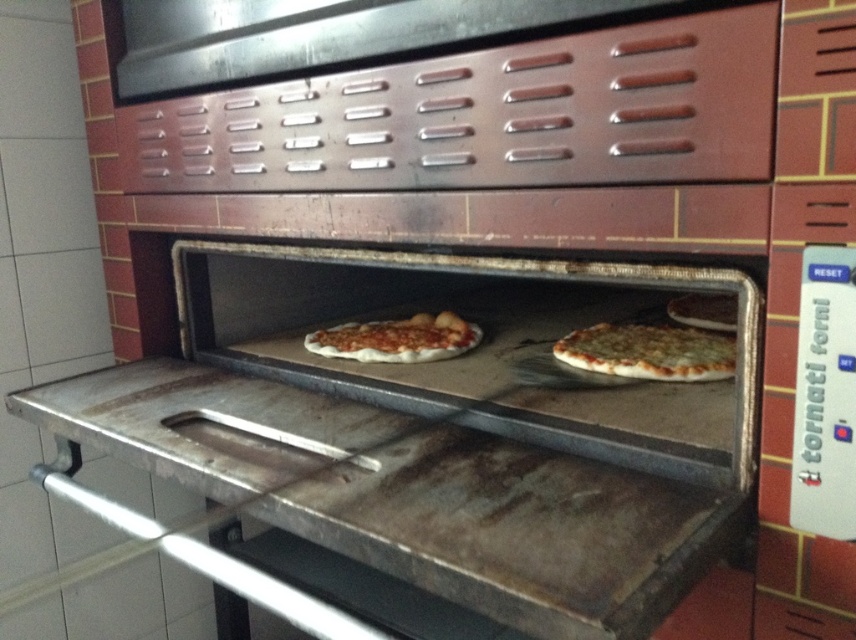
You are a pizza chef standing at the front of the oven. You need to retrieve the golden brown crusty pizza at center. Where exactly should you reach to grab it?

The golden brown crusty pizza at center is located at point 0.550 on the horizontal axis and 0.759 on the vertical axis inside the oven. You should reach towards that coordinate to grab it.

You are a pizza chef who needs to determine which pizza to serve first based on their thickness. According to the oven, which pizza should be served first, the golden brown crusty pizza at center or the matte white pizza at center?

The golden brown crusty pizza at center is thinner than the matte white pizza at center, so it should be served first as it is cooked through and less likely to be undercooked compared to the thicker matte white pizza at center.

You are a pizza chef working in this pizza oven. You need to check the doneness of the pizza at the point labeled as point (649, 352). What type of pizza is located at this point?

The point (649, 352) is on the golden brown crusty pizza at center, so the pizza at this point is the golden brown crusty pizza at center.